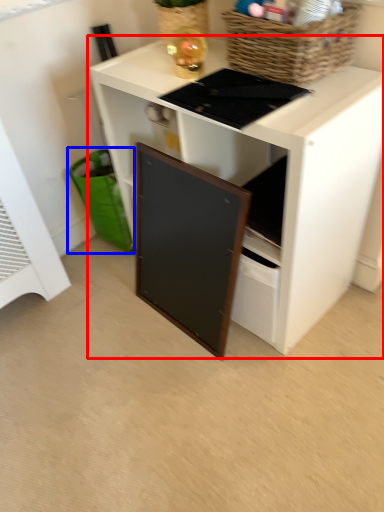
Question: Which object appears closest to the camera in this image, desk (highlighted by a red box) or shopping basket (highlighted by a blue box)?

Choices:
 (A) desk
 (B) shopping basket

Answer: (A)